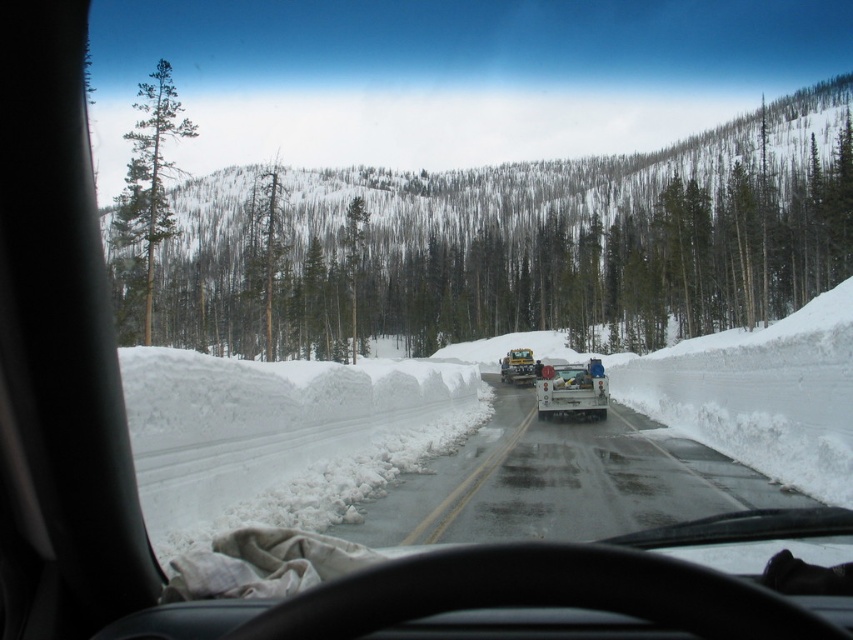
Question: Which is farther from the white matte trailer truck at center?

Choices:
 (A) white glossy trailer truck at center
 (B) white glossy truck at center

Answer: (A)

Question: Is white glossy truck at center positioned in front of white matte trailer truck at center?

Choices:
 (A) yes
 (B) no

Answer: (A)

Question: Among these points, which one is nearest to the camera?

Choices:
 (A) (582, 403)
 (B) (508, 413)

Answer: (A)

Question: Can you confirm if white glossy truck at center is bigger than white glossy trailer truck at center?

Choices:
 (A) no
 (B) yes

Answer: (A)

Question: Which object is positioned farthest from the white matte trailer truck at center?

Choices:
 (A) white glossy trailer truck at center
 (B) white glossy truck at center

Answer: (A)

Question: Is white glossy truck at center to the right of white matte trailer truck at center from the viewer's perspective?

Choices:
 (A) yes
 (B) no

Answer: (B)